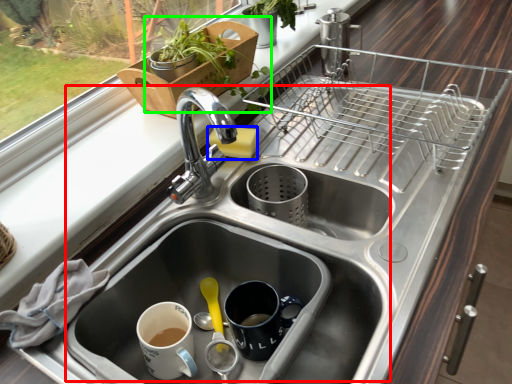
Question: Based on their relative distances, which object is nearer to sink (highlighted by a red box)? Choose from soap (highlighted by a blue box) and houseplant (highlighted by a green box).

Choices:
 (A) soap
 (B) houseplant

Answer: (A)